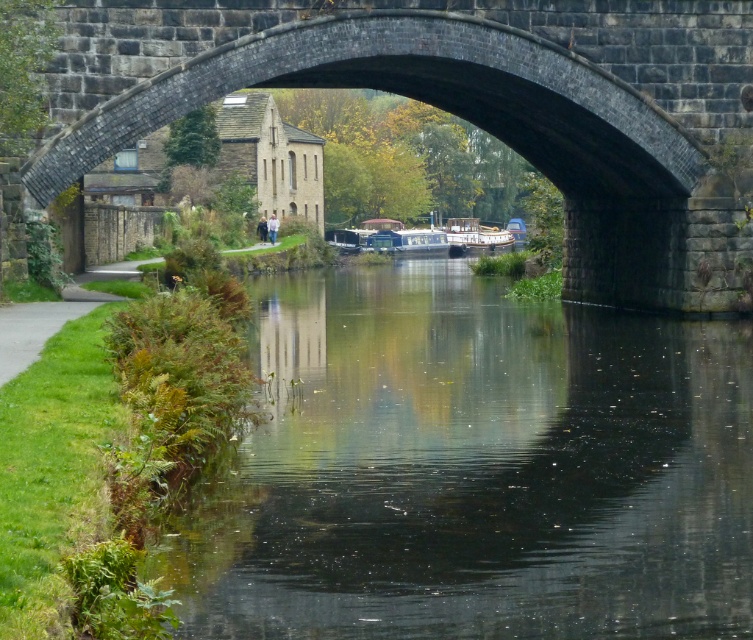
You are standing at the point labeled as point [474,468] in the canal scene. Based on the image, what is the immediate surface you are standing on?

The point [474,468] is on transparent water at center, so the immediate surface you are standing on is transparent water.

You are standing on the stone arch bridge and looking down at the canal. You notice a point marked at coordinates (474, 468). What is located at that point?

The point at coordinates (474, 468) indicates transparent water at center.

You are a boat captain planning to navigate a new narrowboat through the canal. You see the transparent water at center and the wooden polished boat at center. Which object is situated higher in the scene?

The wooden polished boat at center is situated higher than the transparent water at center because the water is located below the boat.